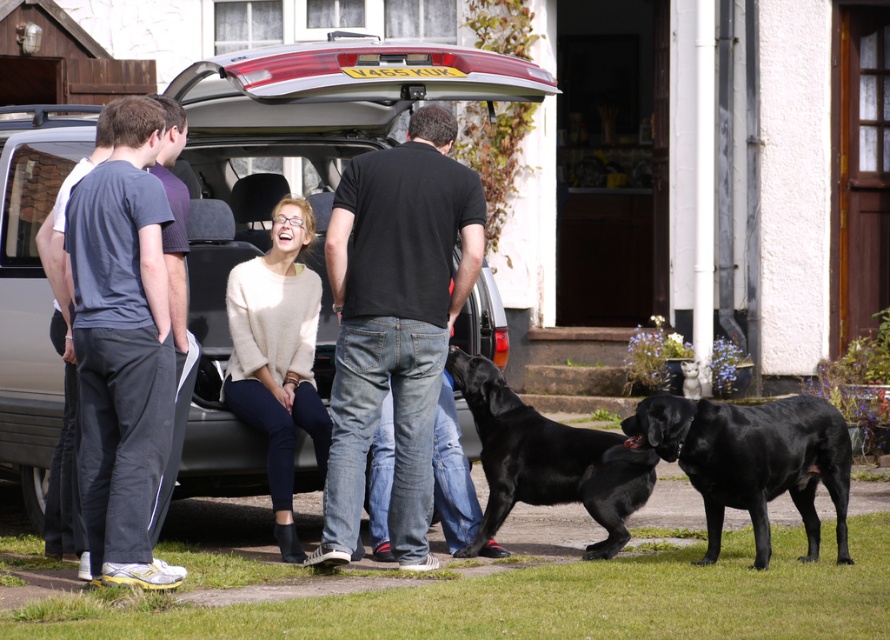
Question: Which object is positioned farthest from the satin silver car at center?

Choices:
 (A) black cotton t-shirt at center
 (B) black glossy dog at lower right
 (C) dark gray sweatpants at left

Answer: (B)

Question: Does black cotton t-shirt at center have a greater width compared to light beige sweater at center?

Choices:
 (A) no
 (B) yes

Answer: (B)

Question: Which point is closer to the camera taking this photo?

Choices:
 (A) (816, 445)
 (B) (418, 140)
 (C) (306, 228)

Answer: (B)

Question: Which object is positioned farthest from the black matte dog at center?

Choices:
 (A) black glossy dog at lower right
 (B) black cotton t-shirt at center
 (C) dark gray sweatpants at left
 (D) satin silver car at center

Answer: (C)

Question: Is black cotton t-shirt at center bigger than black glossy dog at lower right?

Choices:
 (A) yes
 (B) no

Answer: (A)

Question: Does satin silver car at center appear under black cotton t-shirt at center?

Choices:
 (A) no
 (B) yes

Answer: (A)